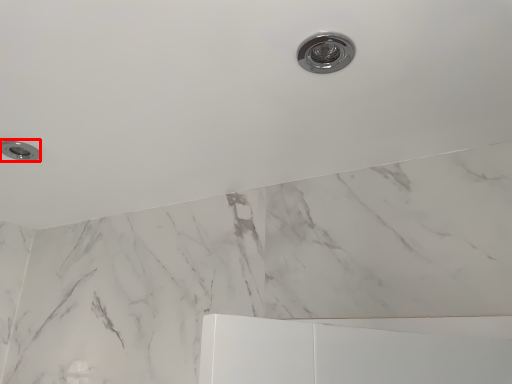
Question: From the image's perspective, where is knob (annotated by the red box) located in relation to plumbing fixture in the image?

Choices:
 (A) above
 (B) below

Answer: (B)